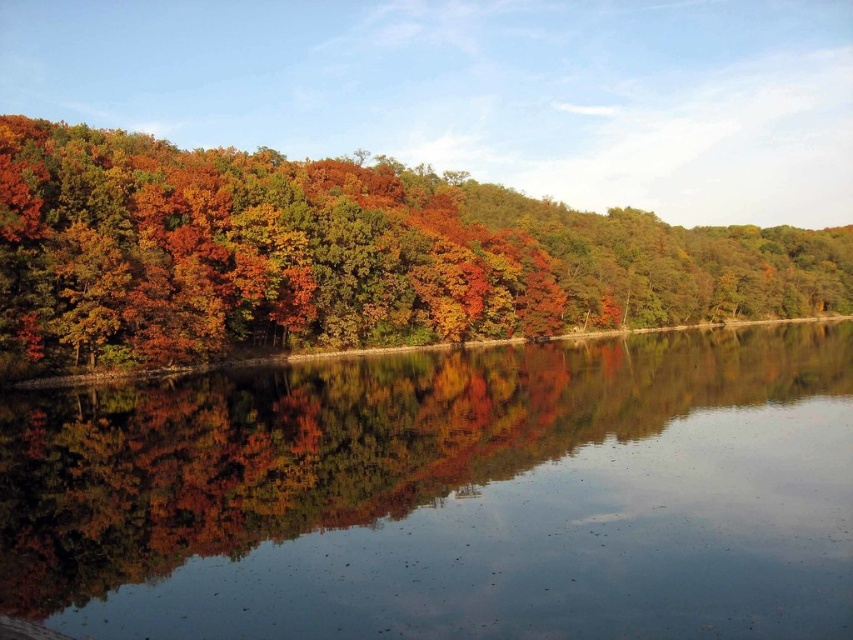
Is transparent water at center above autumn leaves at left?

Actually, transparent water at center is below autumn leaves at left.

Which of these two, transparent water at center or autumn leaves at left, stands shorter?

Standing shorter between the two is transparent water at center.

Between point (473, 470) and point (287, 236), which one is positioned in front?

Point (473, 470) is more forward.

Locate an element on the screen. The image size is (853, 640). transparent water at center is located at coordinates (447, 496).